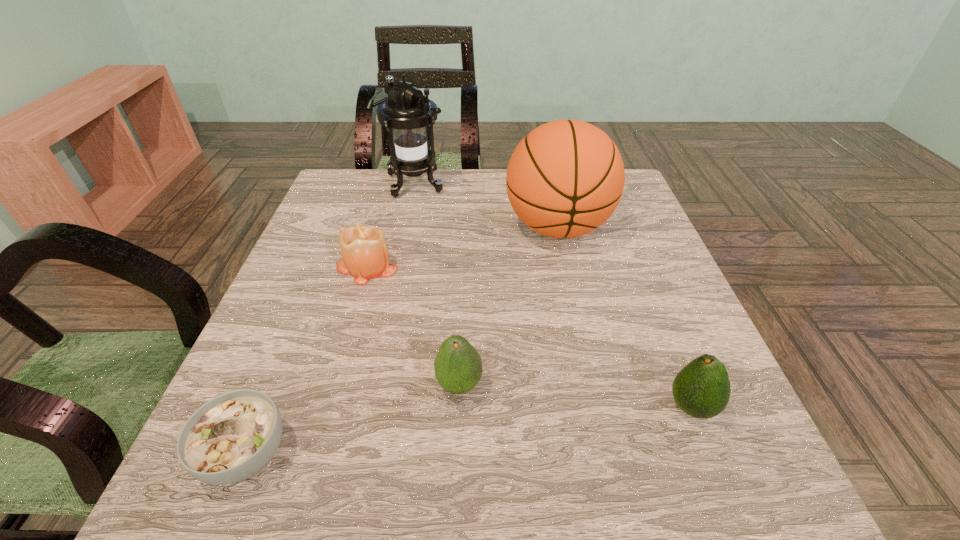
I want to click on free space that satisfies the following two spatial constraints: 1. on the front side of the lantern; 2. on the right side of the basketball, so [403, 227].